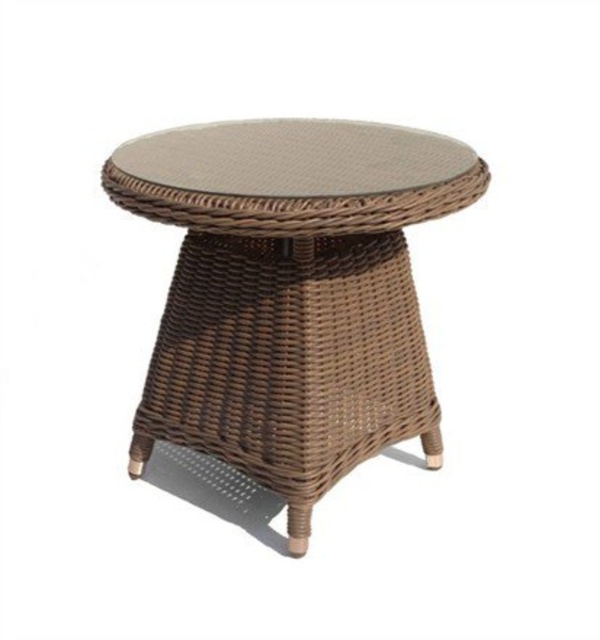
Between brown woven side table at center and brown woven table at center, which one appears on the left side from the viewer's perspective?

From the viewer's perspective, brown woven side table at center appears more on the left side.

Is point (261, 348) farther from camera compared to point (376, 156)?

No, it is in front of (376, 156).

Who is more distant from viewer, (238, 292) or (193, 173)?

Positioned behind is point (238, 292).

Where is `brown woven side table at center`? The width and height of the screenshot is (600, 640). brown woven side table at center is located at coordinates (292, 294).